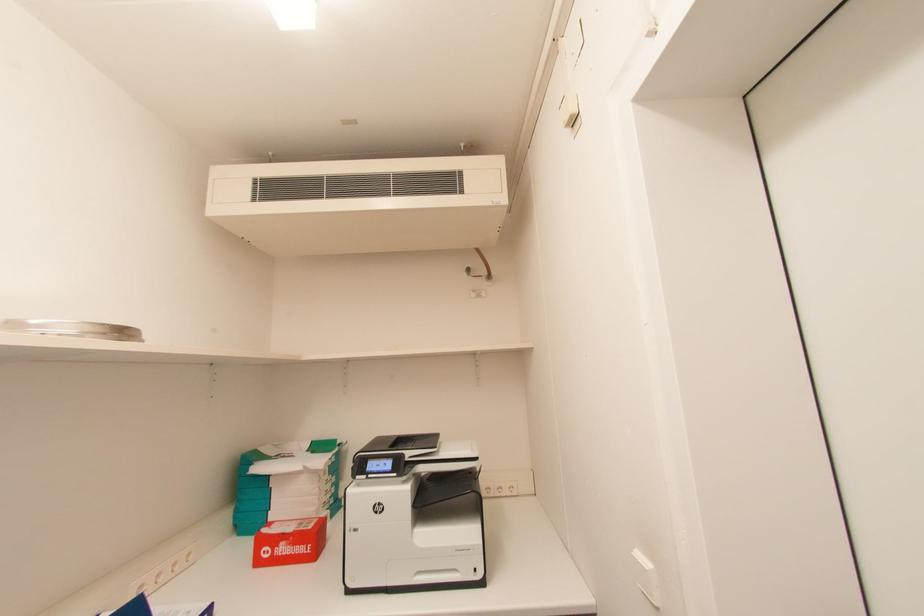
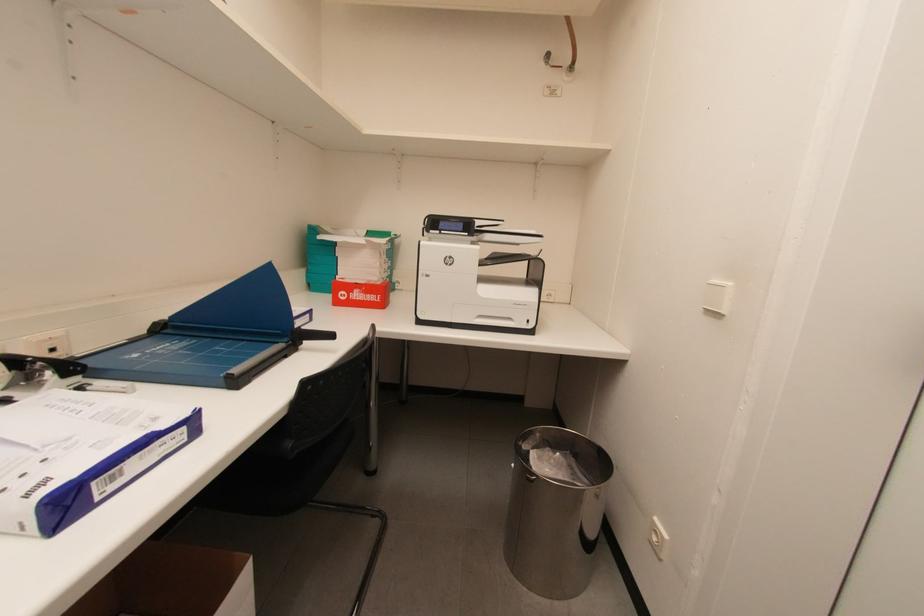
What movement of the cameraman would produce the second image?

The cameraman walked toward left, backward.